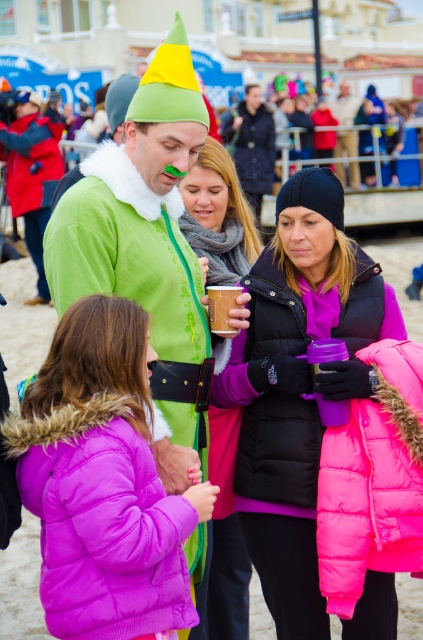
You are at a beach festival and want to place a small decoration on the pink matte cup at center. The decoration requires a base that is wider than the cup. Can the matte green hat at upper center serve as a stable base for this decoration?

The matte green hat at upper center has a larger width than the pink matte cup at center, so it can provide a stable base for the decoration since its width exceeds the cup.

You are a photographer trying to capture a group photo of the purple puffy coat at center and the matte brown paper cup at center. Which object should you place closer to the camera to ensure both appear equally sized in the photo?

To make both the purple puffy coat at center and the matte brown paper cup at center appear equally sized in the photo, you should place the purple puffy coat at center closer to the camera since it has a lesser width than the matte brown paper cup at center.